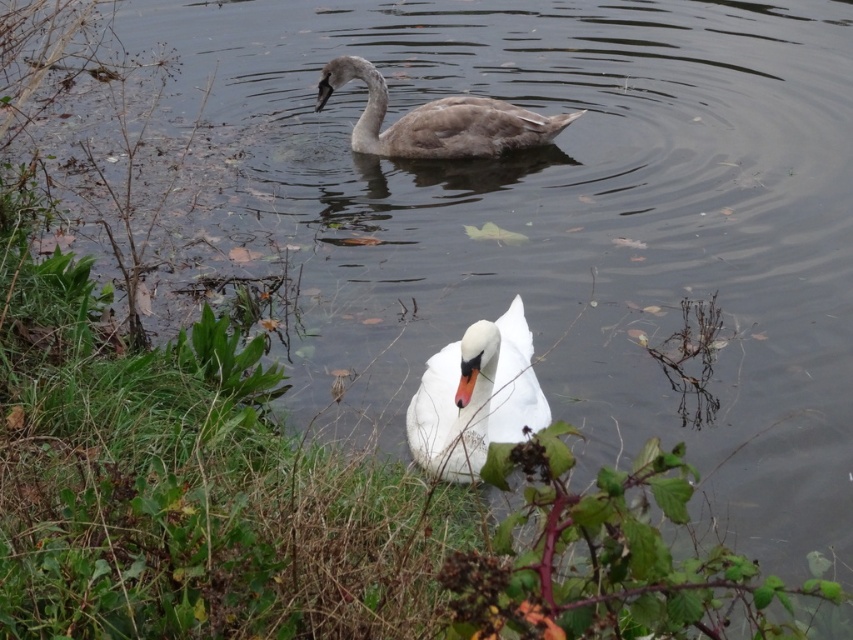
You are a wildlife photographer aiming to capture a clear shot of both the white glossy swan at center and the gray matte swan at upper center. Based on their positions, which swan is blocking the view of the other?

The gray matte swan at upper center is blocking the view of the white glossy swan at center because it is positioned above it.

Consider the image. You are a photographer aiming to capture both the white glossy swan at center and the gray matte swan at upper center in a single frame. Based on their positions, which swan should you adjust your camera to focus on first to ensure both are in the shot?

The white glossy swan at center is to the right of the gray matte swan at upper center, so you should focus on the gray matte swan at upper center first to ensure both are in the frame.

You are a photographer aiming to capture a clear shot of the white glossy swan at center and the gray matte swan at upper center. Which swan will appear closer to the camera in the photo?

The white glossy swan at center will appear closer to the camera because it is positioned in front of the gray matte swan at upper center.